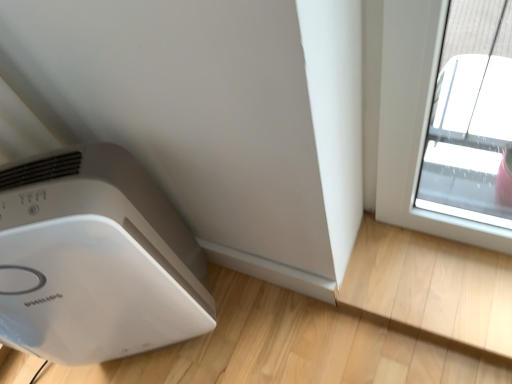
The height and width of the screenshot is (384, 512). In order to click on spots to the right of white plastic air purifier at lower left in this screenshot , I will do `click(268, 329)`.